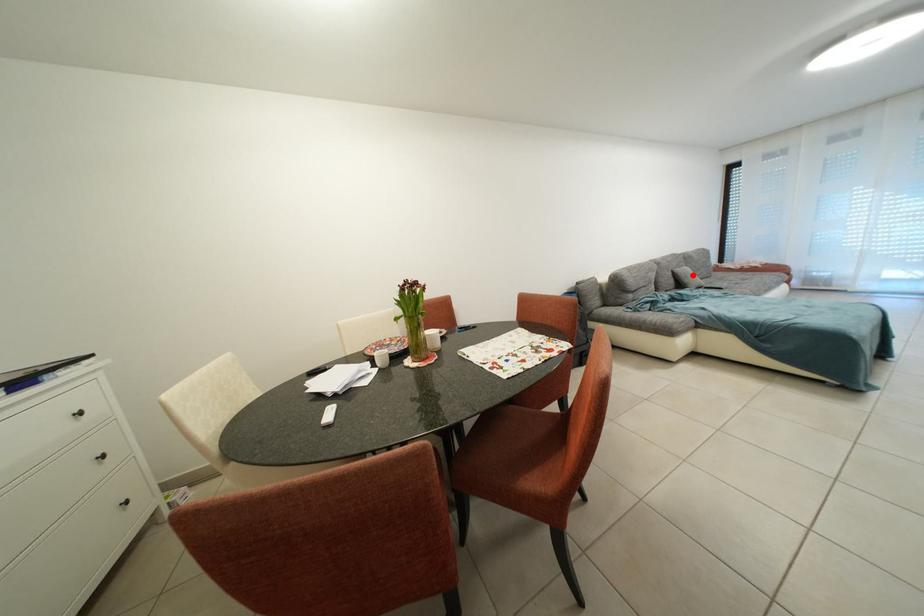
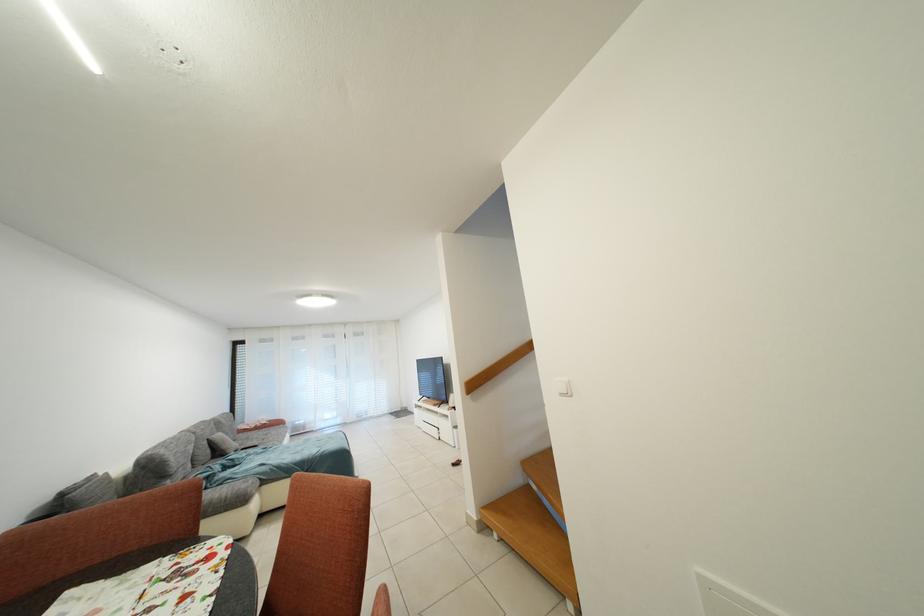
In the second image, find the point that corresponds to the highlighted location in the first image.

(227, 440)